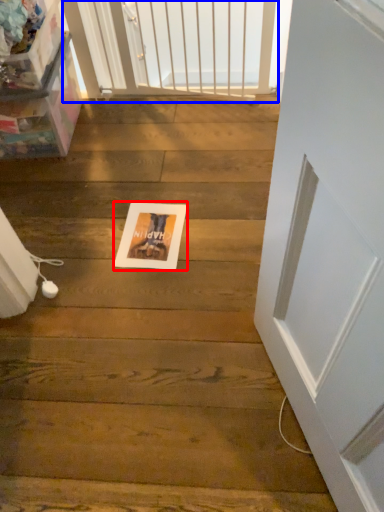
Question: Which of the following is the farthest to the observer, postcard (highlighted by a red box) or screen door (highlighted by a blue box)?

Choices:
 (A) postcard
 (B) screen door

Answer: (B)